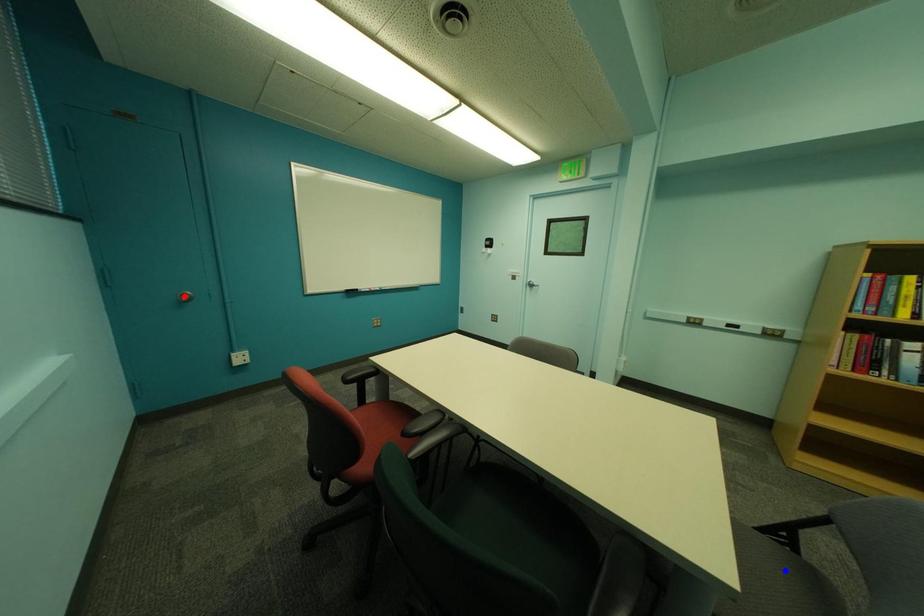
Question: Which of the two points in the image is closer to the camera?

Choices:
 (A) Blue point is closer.
 (B) Red point is closer.

Answer: (A)